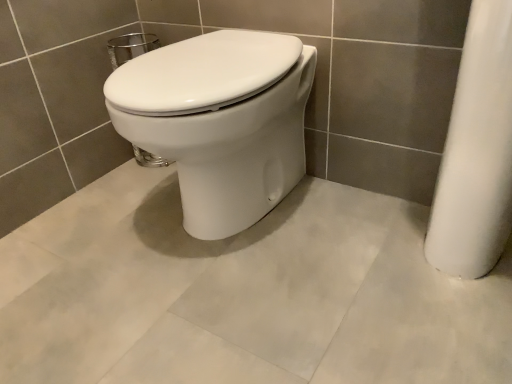
The width and height of the screenshot is (512, 384). Find the location of `free region under white glossy toilet at center (from a real-world perspective)`. free region under white glossy toilet at center (from a real-world perspective) is located at coordinates (212, 230).